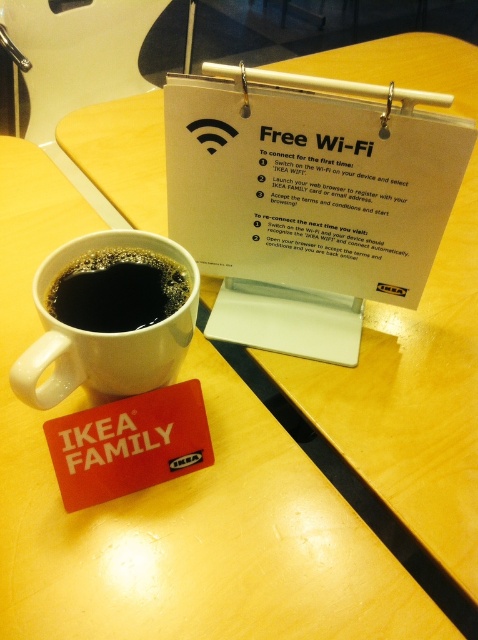
Is white plastic clipboard at upper center below white matte mug at upper left?

No, white plastic clipboard at upper center is not below white matte mug at upper left.

What do you see at coordinates (307, 198) in the screenshot? I see `white plastic clipboard at upper center` at bounding box center [307, 198].

Find the location of `white plastic clipboard at upper center`. white plastic clipboard at upper center is located at coordinates (307, 198).

Is white matte mug at upper left shorter than black matte cup at lower left?

In fact, white matte mug at upper left may be taller than black matte cup at lower left.

Who is more forward, (14, 369) or (139, 307)?

Point (14, 369) is in front.

This screenshot has height=640, width=478. Identify the location of white matte mug at upper left. pyautogui.click(x=104, y=333).

Is white plastic clipboard at upper center positioned at the back of black matte cup at lower left?

Yes.

Does point (340, 161) come closer to viewer compared to point (140, 280)?

No.

The image size is (478, 640). What do you see at coordinates (307, 198) in the screenshot?
I see `white plastic clipboard at upper center` at bounding box center [307, 198].

Identify the location of white plastic clipboard at upper center. This screenshot has height=640, width=478. (307, 198).